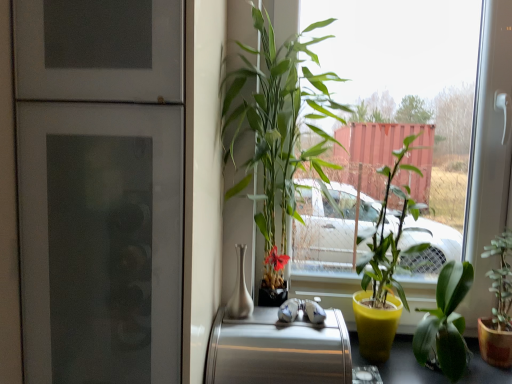
Question: Based on their sizes in the image, would you say green leafy plant at center is bigger or smaller than brushed metal toaster at center?

Choices:
 (A) small
 (B) big

Answer: (B)

Question: Considering the positions of green leafy plant at center and brushed metal toaster at center in the image, is green leafy plant at center taller or shorter than brushed metal toaster at center?

Choices:
 (A) short
 (B) tall

Answer: (B)

Question: Which object is the farthest from the smooth black table at lower right?

Choices:
 (A) satin silver vase at center
 (B) yellow matte pot at center, positioned as the second houseplant in left-to-right order
 (C) brushed metal toaster at center
 (D) green glossy plant at center, the fourth houseplant from the right
 (E) green glossy leafy plant at lower right, marked as the second houseplant in a right-to-left arrangement

Answer: (D)

Question: Which is farther from the satin silver vase at center?

Choices:
 (A) green glossy leafy plant at lower right, the 3th houseplant when ordered from left to right
 (B) brushed metal toaster at center
 (C) yellow matte pot at center, positioned as the second houseplant in left-to-right order
 (D) matte glass refrigerator at left
 (E) green leafy plant at center

Answer: (A)